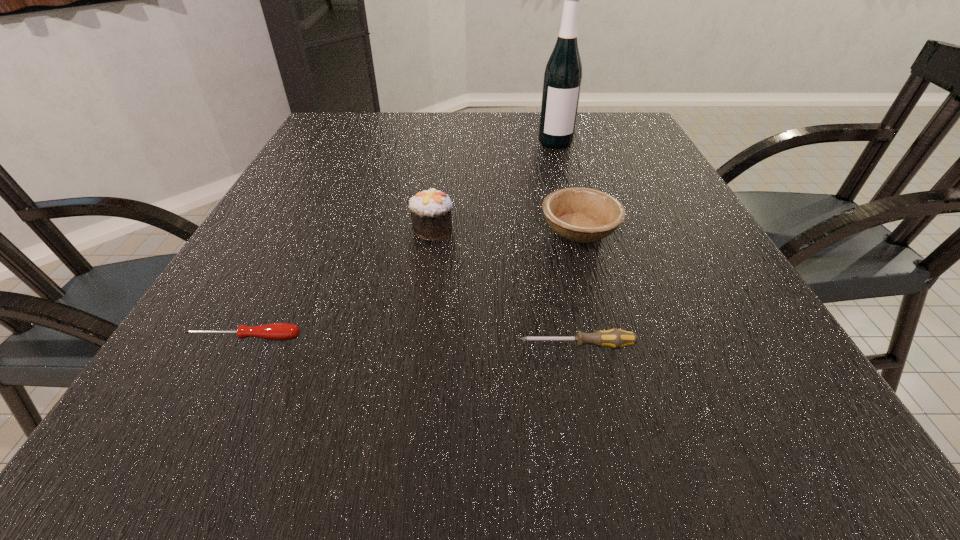
Locate an element on the screen. The width and height of the screenshot is (960, 540). free space between the farthest object and the third tallest object is located at coordinates (567, 186).

I want to click on vacant space that's between the wine bottle and the leftmost object, so click(x=399, y=240).

The height and width of the screenshot is (540, 960). Identify the location of object that stands as the closest to the leftmost object. (430, 210).

At what (x,y) coordinates should I click in order to perform the action: click on object that is the fourth closest to the tallest object. Please return your answer as a coordinate pair (x, y). The height and width of the screenshot is (540, 960). Looking at the image, I should click on (276, 331).